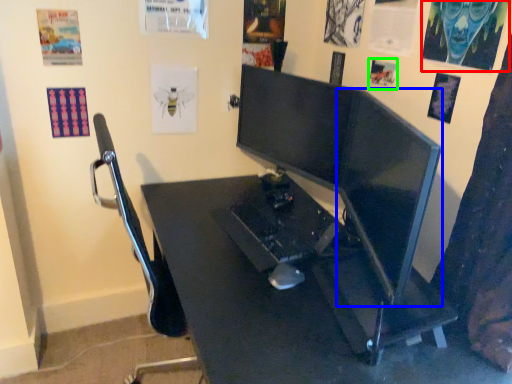
Question: Based on their relative distances, which object is farther from poster page (highlighted by a red box)? Choose from computer monitor (highlighted by a blue box) and poster page (highlighted by a green box).

Choices:
 (A) computer monitor
 (B) poster page

Answer: (A)